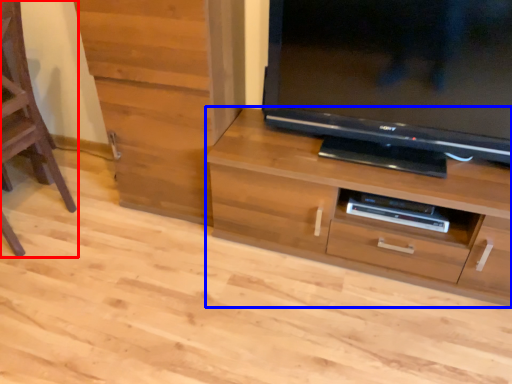
Question: Among these objects, which one is nearest to the camera, furniture (highlighted by a red box) or chest of drawers (highlighted by a blue box)?

Choices:
 (A) furniture
 (B) chest of drawers

Answer: (A)